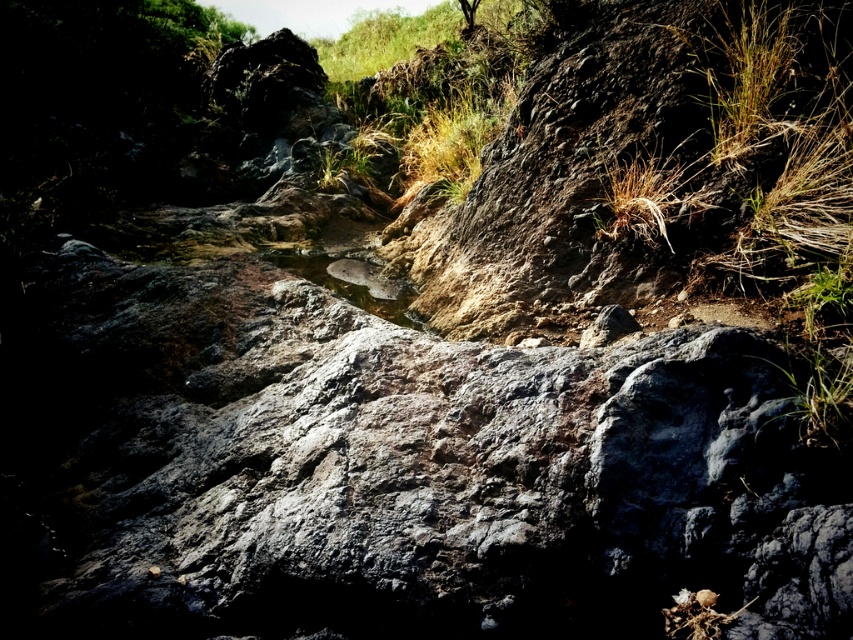
Question: Is the position of dry grass at upper center less distant than that of greenish reflective water at center?

Choices:
 (A) no
 (B) yes

Answer: (A)

Question: Which point is closer to the camera?

Choices:
 (A) (440, 144)
 (B) (398, 305)

Answer: (B)

Question: Does dry grass at upper center have a lesser width compared to greenish reflective water at center?

Choices:
 (A) no
 (B) yes

Answer: (B)

Question: Among these points, which one is farthest from the camera?

Choices:
 (A) (309, 262)
 (B) (436, 156)

Answer: (B)

Question: Can you confirm if dry grass at upper center is smaller than greenish reflective water at center?

Choices:
 (A) no
 (B) yes

Answer: (A)